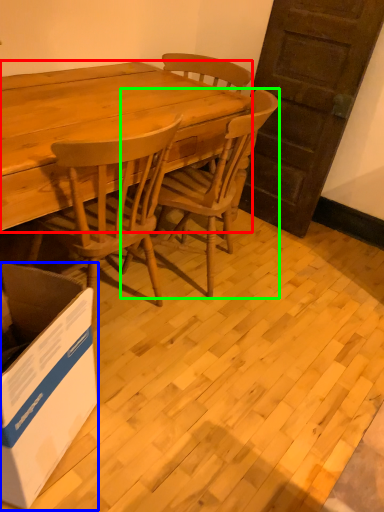
Question: Which is nearer to the desk (highlighted by a red box)? box (highlighted by a blue box) or chair (highlighted by a green box).

Choices:
 (A) box
 (B) chair

Answer: (B)